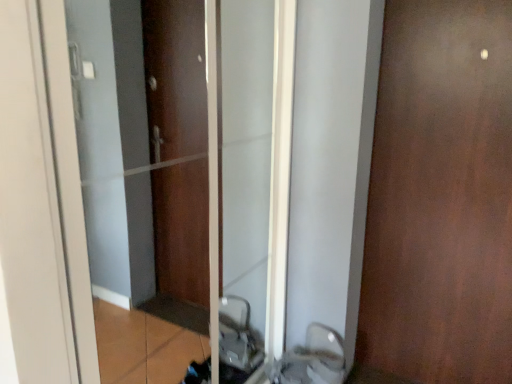
Question: From the image's perspective, is white glossy sink at lower center located above or below matte brown elevator at center?

Choices:
 (A) below
 (B) above

Answer: (A)

Question: Is point (309, 347) closer or farther from the camera than point (242, 34)?

Choices:
 (A) closer
 (B) farther

Answer: (B)

Question: Estimate the real-world distances between objects in this image. Which object is closer to the matte brown elevator at center?

Choices:
 (A) brown matte door at right
 (B) white glossy sink at lower center

Answer: (B)

Question: Which object is positioned farthest from the brown matte door at right?

Choices:
 (A) matte brown elevator at center
 (B) white glossy sink at lower center

Answer: (A)